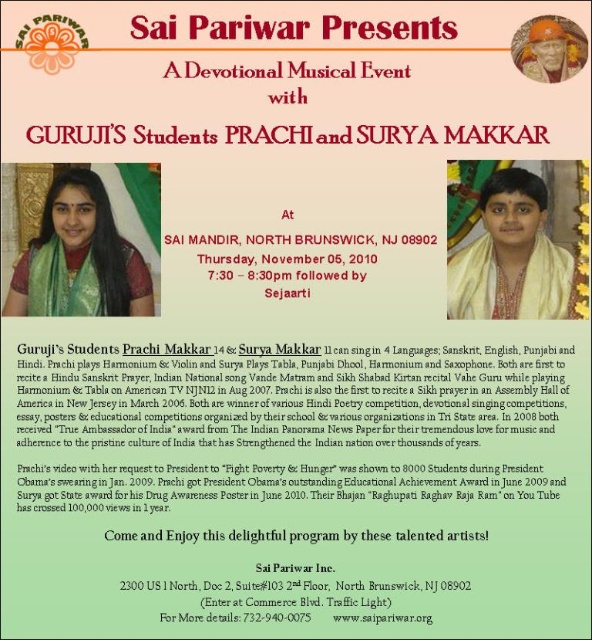
Is green fabric at upper left wider than white paper at center?

Yes, green fabric at upper left is wider than white paper at center.

Between green fabric at upper left and white paper at center, which one has more height?

Standing taller between the two is green fabric at upper left.

Identify the location of green fabric at upper left. (278, 480).

I want to click on green fabric at upper left, so click(278, 480).

This screenshot has height=640, width=592. What do you see at coordinates (79, 257) in the screenshot?
I see `green silk saree at center` at bounding box center [79, 257].

From the picture: Is green silk saree at center shorter than matte gold helmet at upper right?

Incorrect, green silk saree at center's height does not fall short of matte gold helmet at upper right's.

The width and height of the screenshot is (592, 640). Find the location of `green silk saree at center`. green silk saree at center is located at coordinates (79, 257).

Between white silk shawl at upper right and white paper at center, which one appears on the right side from the viewer's perspective?

From the viewer's perspective, white silk shawl at upper right appears more on the right side.

Is point (519, 218) closer to viewer compared to point (365, 241)?

Yes.

This screenshot has width=592, height=640. What are the coordinates of `white silk shawl at upper right` in the screenshot? It's located at (511, 257).